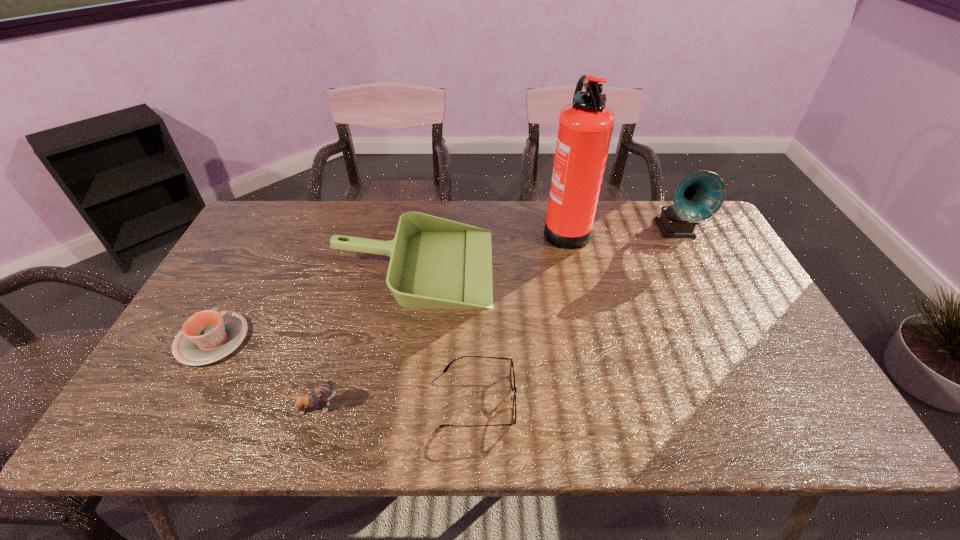
The height and width of the screenshot is (540, 960). I want to click on free space that satisfies the following two spatial constraints: 1. from the horn of the second tallest object; 2. on the scoop of the dustpan, so click(694, 266).

Locate an element on the screen. Image resolution: width=960 pixels, height=540 pixels. free region that satisfies the following two spatial constraints: 1. from the horn of the second tallest object; 2. on the front-facing side of the spectacles is located at coordinates (762, 398).

Image resolution: width=960 pixels, height=540 pixels. Find the location of `free point that satisfies the following two spatial constraints: 1. from the horn of the phonograph_record; 2. on the front-facing side of the kitten`. free point that satisfies the following two spatial constraints: 1. from the horn of the phonograph_record; 2. on the front-facing side of the kitten is located at coordinates (767, 408).